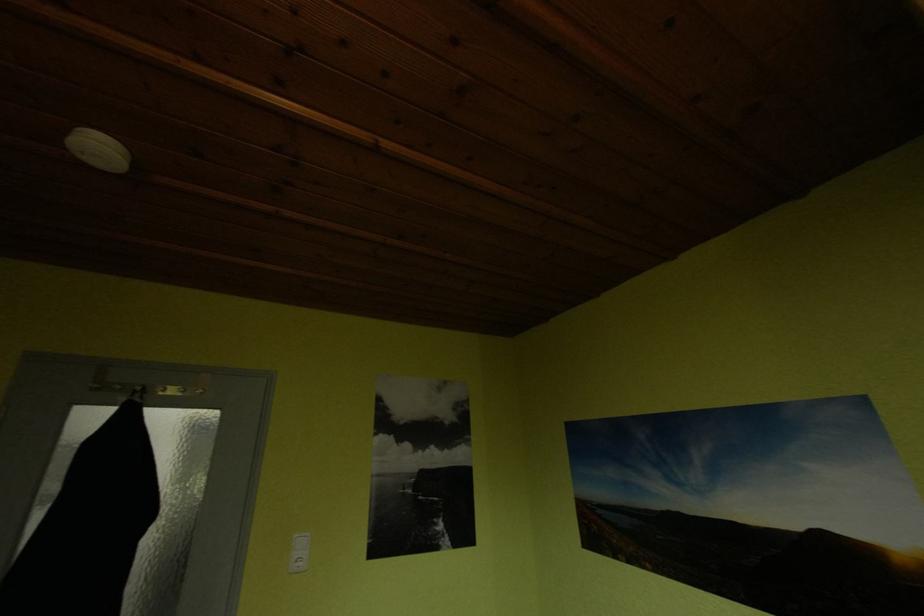
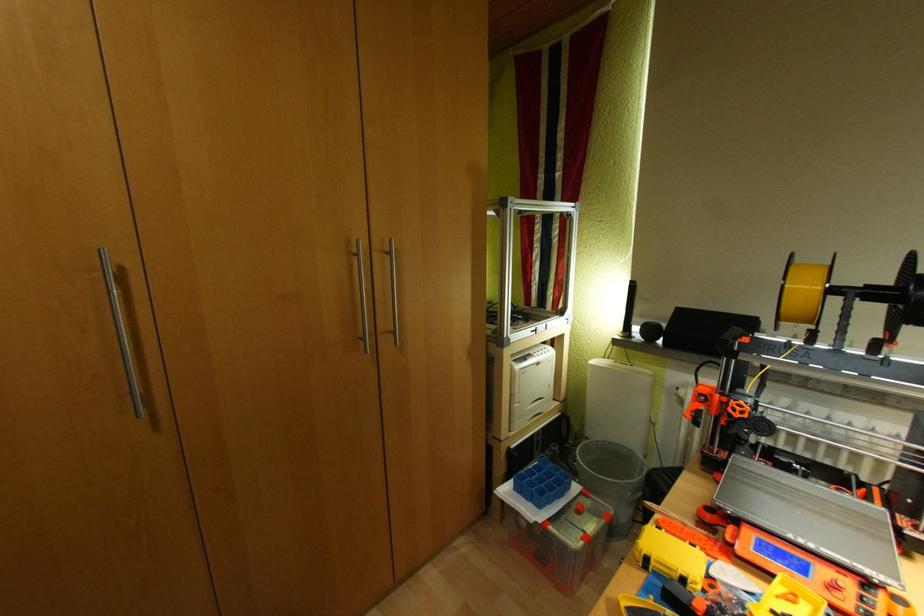
Question: Based on the continuous images, in which direction is the camera rotating? Reply with the corresponding letter.

Choices:
 (A) Left
 (B) Right
 (C) Up
 (D) Down

Answer: (B)